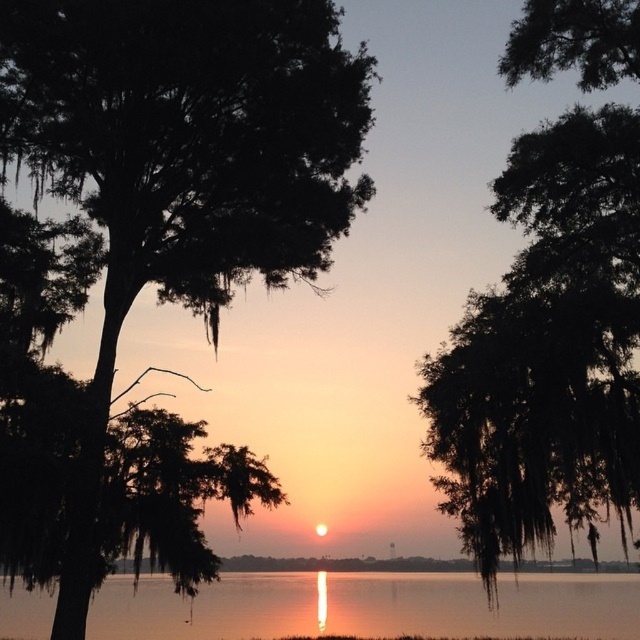
Which is in front, point (45, 58) or point (352, 624)?

Point (45, 58)

You are a GUI agent. You are given a task and a screenshot of the screen. Output one action in this format:
    pyautogui.click(x=<x>, y=<y>)
    Task: Click on the silhouette tree at left
    
    Given the screenshot: What is the action you would take?
    pyautogui.click(x=182, y=164)

Can you confirm if green mossy tree at upper right is positioned below smooth water at center?

Incorrect, green mossy tree at upper right is not positioned below smooth water at center.

How much distance is there between green mossy tree at upper right and smooth water at center?

The distance of green mossy tree at upper right from smooth water at center is 29.68 feet.

Is point (554, 534) positioned in front of point (6, 612)?

Yes, point (554, 534) is closer to viewer.

In order to click on green mossy tree at upper right in this screenshot , I will do `click(547, 349)`.

Does silhouette tree at left have a lesser height compared to green mossy tree at upper right?

Yes.

Can you confirm if silhouette tree at left is bigger than green mossy tree at upper right?

Actually, silhouette tree at left might be smaller than green mossy tree at upper right.

This screenshot has width=640, height=640. What do you see at coordinates (182, 164) in the screenshot?
I see `silhouette tree at left` at bounding box center [182, 164].

Where is `silhouette tree at left`? The width and height of the screenshot is (640, 640). silhouette tree at left is located at coordinates (182, 164).